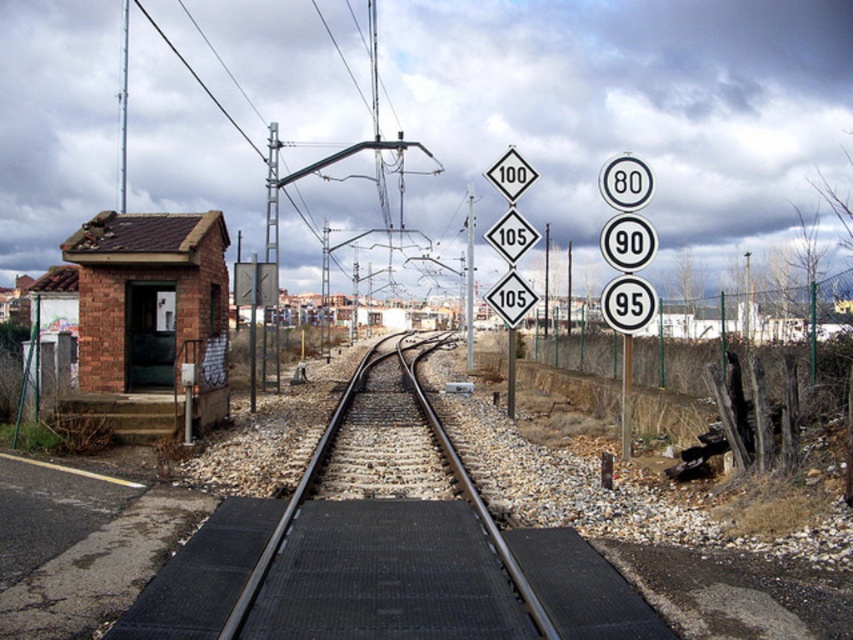
The width and height of the screenshot is (853, 640). I want to click on diamond-shapedwhitetraffic sign at center, so click(x=509, y=298).

What do you see at coordinates (509, 298) in the screenshot?
I see `diamond-shapedwhitetraffic sign at center` at bounding box center [509, 298].

Locate an element on the screen. The image size is (853, 640). diamond-shapedwhitetraffic sign at center is located at coordinates pyautogui.click(x=509, y=298).

Is white reflective speed limit sign at upper right in front of white plastic speed limit sign at center right?

No, it is not.

From the picture: Between white reflective speed limit sign at upper right and white plastic speed limit sign at center right, which one is positioned higher?

Positioned higher is white reflective speed limit sign at upper right.

You are a GUI agent. You are given a task and a screenshot of the screen. Output one action in this format:
    pyautogui.click(x=<x>, y=<y>)
    Task: Click on the white reflective speed limit sign at upper right
    This screenshot has height=640, width=853.
    Given the screenshot: What is the action you would take?
    pyautogui.click(x=627, y=241)

Between diamond-shaped white at center and metallic pole at right, which one is positioned lower?

metallic pole at right is lower down.

The image size is (853, 640). Describe the element at coordinates (511, 236) in the screenshot. I see `diamond-shaped white at center` at that location.

At what (x,y) coordinates should I click in order to perform the action: click on diamond-shaped white at center. Please return your answer as a coordinate pair (x, y). Looking at the image, I should click on (511, 236).